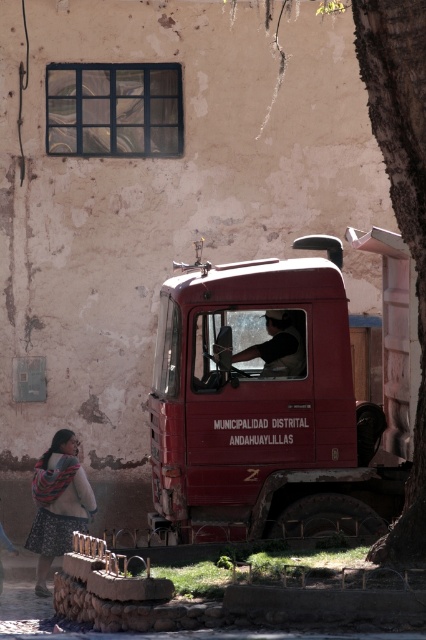
Question: Can you confirm if matte red truck at center is thinner than dark gray fabric shirt at center?

Choices:
 (A) no
 (B) yes

Answer: (A)

Question: Which object appears farthest from the camera in this image?

Choices:
 (A) dark gray fabric shirt at center
 (B) floral skirt at lower left
 (C) smooth bark tree trunk at right
 (D) matte red truck at center

Answer: (B)

Question: Is smooth bark tree trunk at right smaller than floral skirt at lower left?

Choices:
 (A) no
 (B) yes

Answer: (A)

Question: Which object is positioned farthest from the dark gray fabric shirt at center?

Choices:
 (A) floral skirt at lower left
 (B) smooth bark tree trunk at right

Answer: (A)

Question: Does floral skirt at lower left appear on the right side of dark gray fabric shirt at center?

Choices:
 (A) yes
 (B) no

Answer: (B)

Question: Which is nearer to the smooth bark tree trunk at right?

Choices:
 (A) dark gray fabric shirt at center
 (B) floral skirt at lower left
 (C) matte red truck at center

Answer: (A)